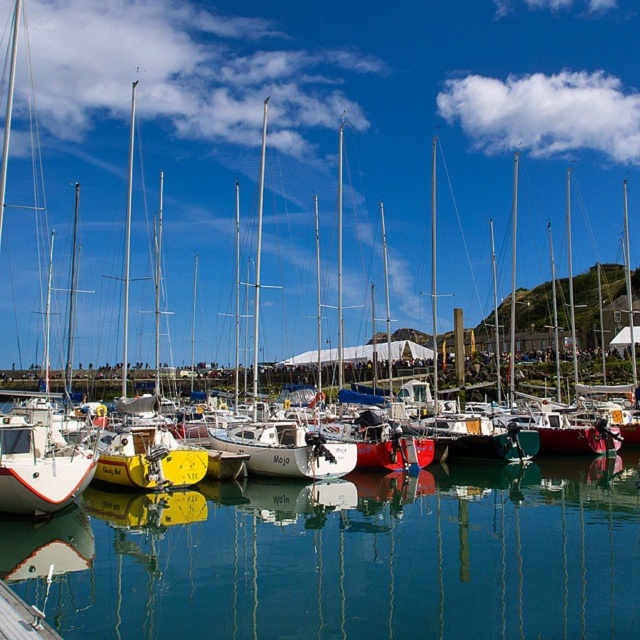
Question: Can you confirm if white matte sailboat at left is positioned above white matte sailboat at center?

Choices:
 (A) yes
 (B) no

Answer: (A)

Question: Which point is farther to the camera?

Choices:
 (A) clear glass water at center
 (B) white matte sailboat at left

Answer: (B)

Question: Can you confirm if clear glass water at center is positioned to the left of white matte sailboat at center?

Choices:
 (A) no
 (B) yes

Answer: (A)

Question: Which object is positioned closest to the white matte sailboat at center?

Choices:
 (A) white matte sailboat at left
 (B) clear glass water at center

Answer: (B)

Question: Does clear glass water at center appear on the right side of white matte sailboat at center?

Choices:
 (A) yes
 (B) no

Answer: (A)

Question: Which point is farther to the camera?

Choices:
 (A) (474, 536)
 (B) (35, 477)

Answer: (A)